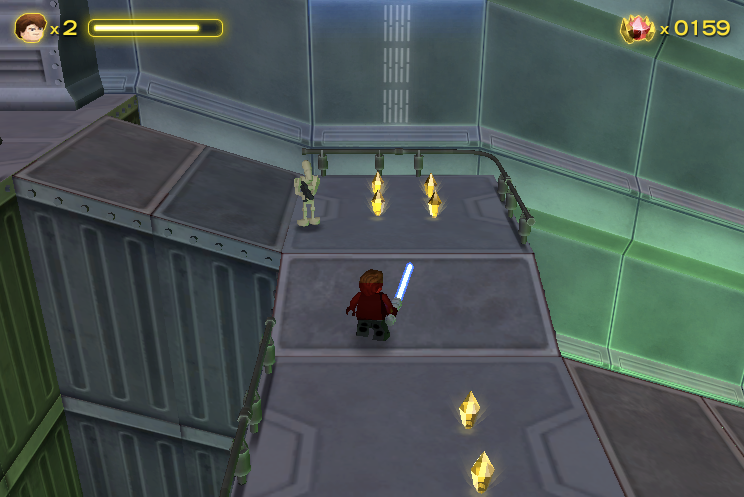
Where is `top landing`? The image size is (744, 497). top landing is located at coordinates (28, 124).